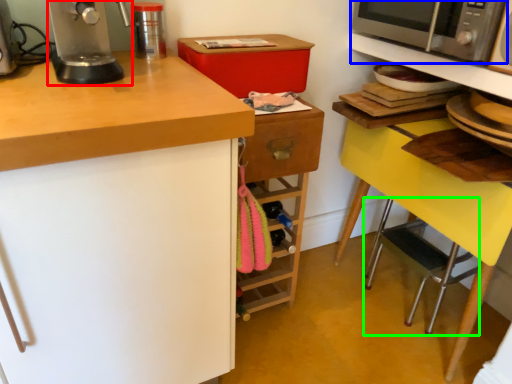
Question: Which object is positioned closest to home appliance (highlighted by a red box)? Select from microwave oven (highlighted by a blue box) and step stool (highlighted by a green box).

Choices:
 (A) microwave oven
 (B) step stool

Answer: (A)